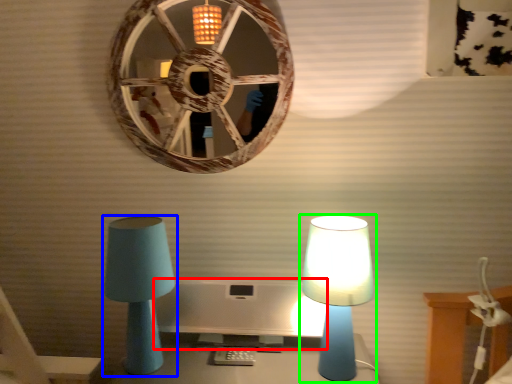
Question: Based on their relative distances, which object is farther from computer monitor (highlighted by a red box)? Choose from lamp (highlighted by a blue box) and lamp (highlighted by a green box).

Choices:
 (A) lamp
 (B) lamp

Answer: (B)